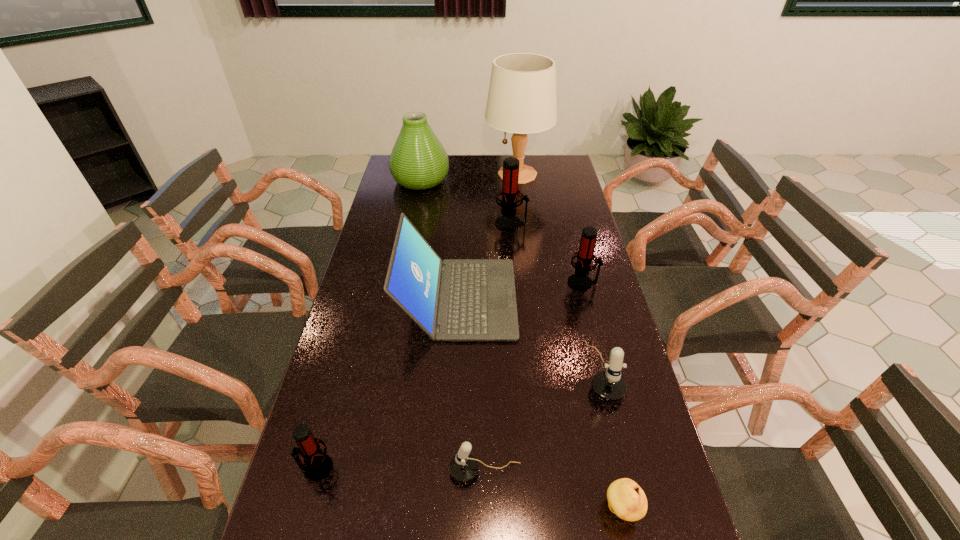
You are a GUI agent. You are given a task and a screenshot of the screen. Output one action in this format:
    pyautogui.click(x=<x>, y=<y>)
    Task: Click on the free space between the second red microphone from left to right and the nearest red microphone
    
    Given the screenshot: What is the action you would take?
    point(414,346)

You are a GUI agent. You are given a task and a screenshot of the screen. Output one action in this format:
    pyautogui.click(x=<x>, y=<y>)
    Task: Click on the free space between the pear and the leftmost microphone
    The width and height of the screenshot is (960, 540).
    Given the screenshot: What is the action you would take?
    pyautogui.click(x=469, y=489)

At what (x,y) coordinates should I click in order to perform the action: click on free space that is in between the vase and the beige table lamp. Please return your answer as a coordinate pair (x, y). The width and height of the screenshot is (960, 540). Looking at the image, I should click on (469, 177).

The image size is (960, 540). Identify the location of unoccupied position between the tallest object and the green vase. (469, 177).

Locate an element on the screen. The width and height of the screenshot is (960, 540). object that is the third closest to the shortest microphone is located at coordinates (317, 465).

The width and height of the screenshot is (960, 540). I want to click on object that is the second closest to the leftmost microphone, so click(x=455, y=299).

Identify the location of microphone object that ranks as the second closest to the nearest red microphone. (608, 385).

Locate which microphone ranks in proximity to the second red microphone from right to left. Please provide its 2D coordinates. Your answer should be formatted as a tuple, i.e. [(x, y)], where the tuple contains the x and y coordinates of a point satisfying the conditions above.

[(579, 281)]

Identify which red microphone is the third closest to the gray laptop computer. Please provide its 2D coordinates. Your answer should be formatted as a tuple, i.e. [(x, y)], where the tuple contains the x and y coordinates of a point satisfying the conditions above.

[(317, 465)]

Find the location of a particular element. red microphone object that ranks as the third closest to the tallest object is located at coordinates (317, 465).